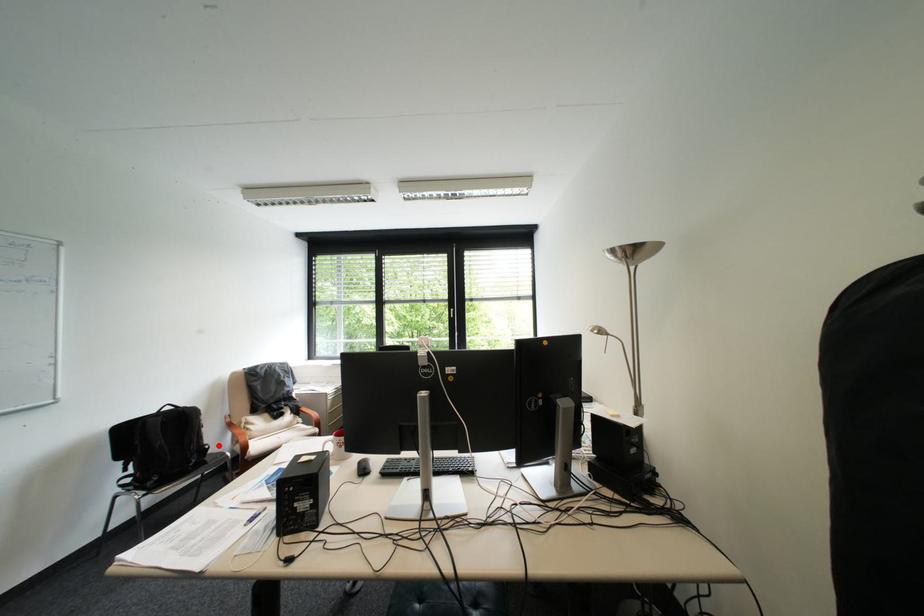
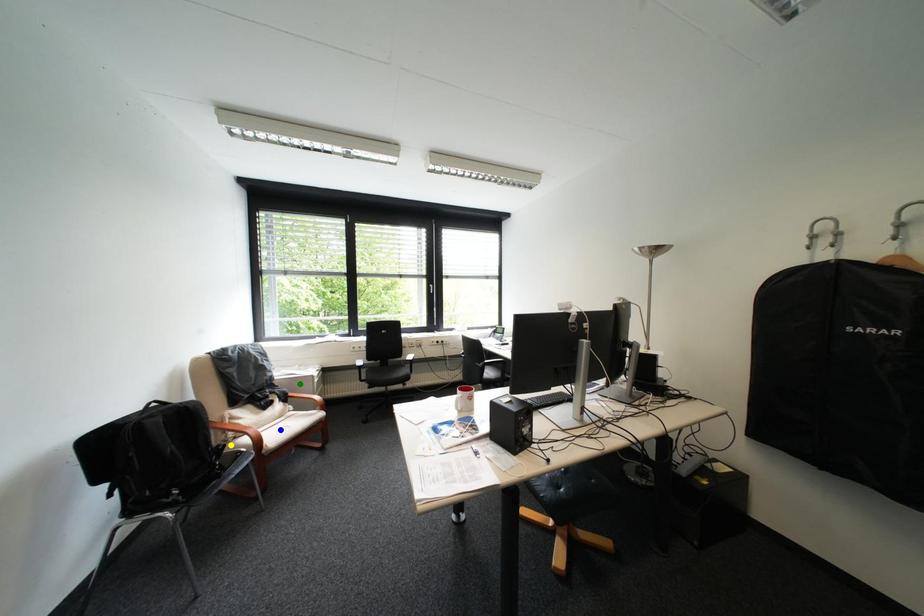
Question: I am providing you with two images of the same scene from different viewpoints. A red point is marked on the first image. You are given multiple points on the second image. Can you choose the point in image 2 that corresponds to the point in image 1?

Choices:
 (A) yellow point
 (B) blue point
 (C) green point

Answer: (A)